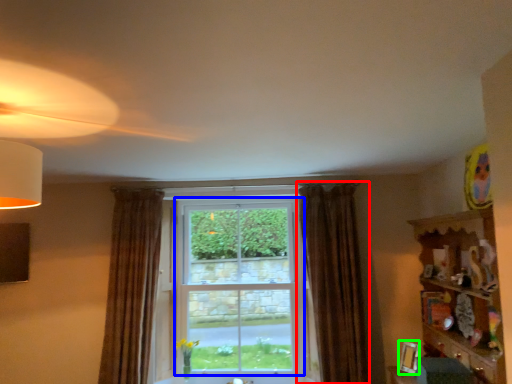
Question: Which object is the closest to the curtain (highlighted by a red box)? Choose among these: window (highlighted by a blue box) or picture frame (highlighted by a green box).

Choices:
 (A) window
 (B) picture frame

Answer: (B)